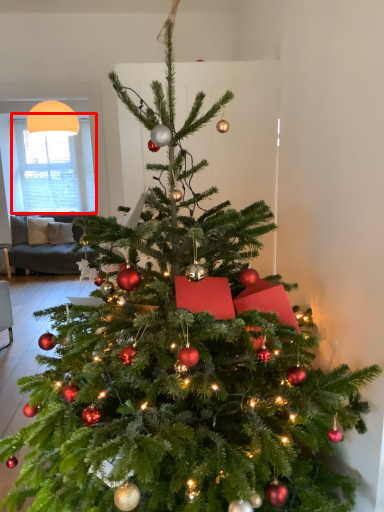
Question: From the image's perspective, considering the relative positions of window screen (annotated by the red box) and lamp in the image provided, where is window screen (annotated by the red box) located with respect to the staircase?

Choices:
 (A) above
 (B) below

Answer: (B)